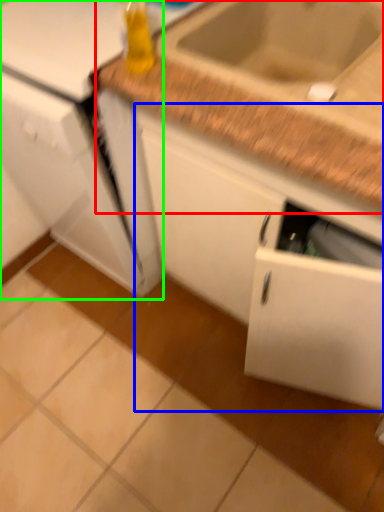
Question: Estimate the real-world distances between objects in this image. Which object is farther from countertop (highlighted by a red box), cabinetry (highlighted by a blue box) or appliance (highlighted by a green box)?

Choices:
 (A) cabinetry
 (B) appliance

Answer: (B)